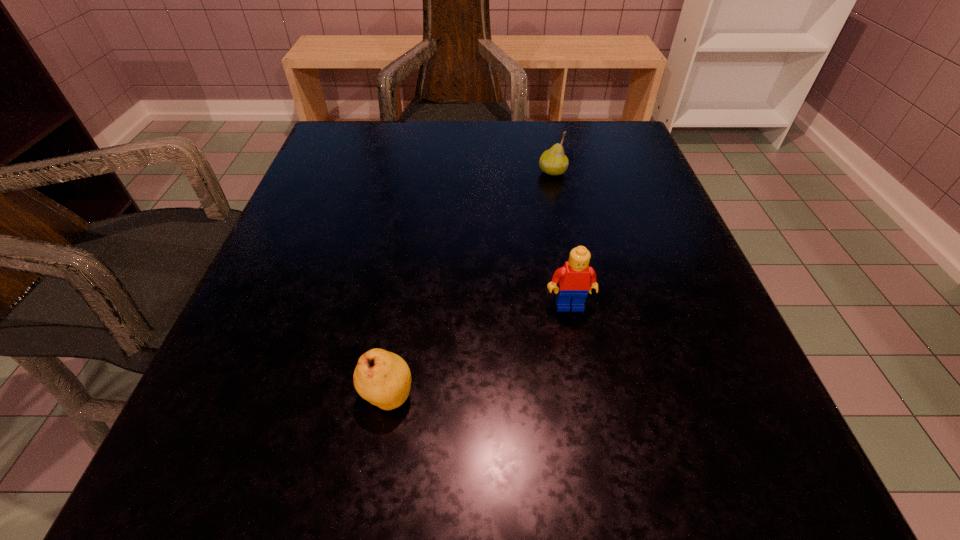
You are a GUI agent. You are given a task and a screenshot of the screen. Output one action in this format:
    pyautogui.click(x=<x>, y=<y>)
    Task: Click on the tallest object
    
    Given the screenshot: What is the action you would take?
    pyautogui.click(x=575, y=278)

The height and width of the screenshot is (540, 960). What are the coordinates of `the second farthest object` in the screenshot? It's located at (575, 278).

You are a GUI agent. You are given a task and a screenshot of the screen. Output one action in this format:
    pyautogui.click(x=<x>, y=<y>)
    Task: Click on the farther pear
    
    Given the screenshot: What is the action you would take?
    pyautogui.click(x=553, y=161)

Find the location of a particular element. The height and width of the screenshot is (540, 960). the right pear is located at coordinates (553, 161).

Identify the location of the nearer pear. 383,378.

You are a GUI agent. You are given a task and a screenshot of the screen. Output one action in this format:
    pyautogui.click(x=<x>, y=<y>)
    Task: Click on the left pear
    Image resolution: width=960 pixels, height=540 pixels.
    Given the screenshot: What is the action you would take?
    pyautogui.click(x=383, y=378)

Identify the location of blank space located 0.160m on the face of the second farthest object. The width and height of the screenshot is (960, 540). (588, 411).

I want to click on free space located on the left of the right pear, so click(x=424, y=172).

The height and width of the screenshot is (540, 960). I want to click on free space located 0.070m on the front of the nearer pear, so pos(374,478).

This screenshot has height=540, width=960. In order to click on object at the far edge in this screenshot , I will do `click(553, 161)`.